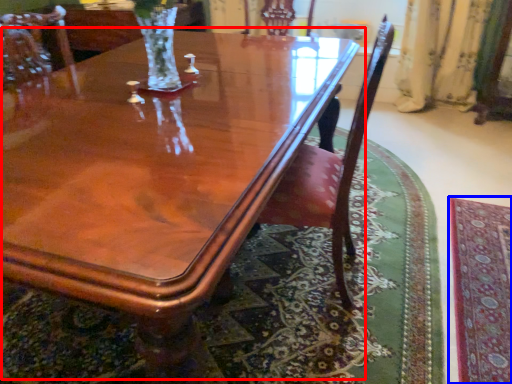
Question: Which object appears farthest to the camera in this image, coffee table (highlighted by a red box) or mat (highlighted by a blue box)?

Choices:
 (A) coffee table
 (B) mat

Answer: (B)